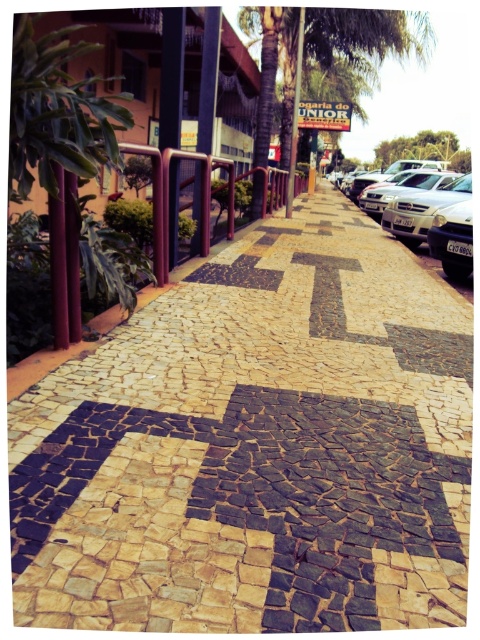
Question: Which of these objects is positioned closest to the natural stone mosaic at center?

Choices:
 (A) green leafy palm tree at upper center
 (B) silver metallic car at right

Answer: (B)

Question: Can you confirm if natural stone mosaic at center is positioned below silver metallic car at right?

Choices:
 (A) yes
 (B) no

Answer: (A)

Question: Does natural stone mosaic at center come in front of green leafy palm tree at upper center?

Choices:
 (A) no
 (B) yes

Answer: (B)

Question: Among these objects, which one is farthest from the camera?

Choices:
 (A) green leafy palm tree at upper center
 (B) natural stone mosaic at center

Answer: (A)

Question: Considering the real-world distances, which object is closest to the natural stone mosaic at center?

Choices:
 (A) silver metallic car at right
 (B) green leafy palm tree at upper center

Answer: (A)

Question: Is green leafy palm tree at upper center wider than silver metallic car at right?

Choices:
 (A) yes
 (B) no

Answer: (A)